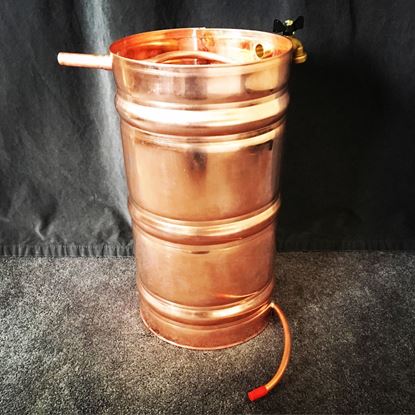
Identify the location of gold colored cord. pos(280,369).